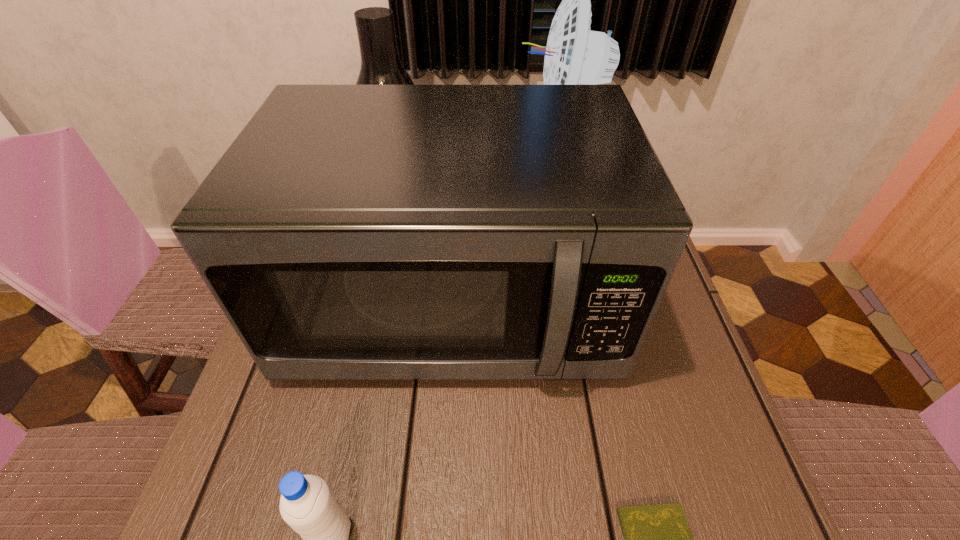
Identify the location of microwave oven that is positioned at the left edge. This screenshot has height=540, width=960. (350, 232).

Find the location of a particular element. The image size is (960, 540). fan that is at the right edge is located at coordinates (574, 55).

Locate an element on the screen. microwave oven present at the right edge is located at coordinates (350, 232).

At what (x,y) coordinates should I click in order to perform the action: click on object at the far right corner. Please return your answer as a coordinate pair (x, y). Looking at the image, I should click on (574, 55).

Image resolution: width=960 pixels, height=540 pixels. Find the location of `free space at the left edge of the desktop`. free space at the left edge of the desktop is located at coordinates (247, 431).

Locate an element on the screen. This screenshot has height=540, width=960. free location at the right edge of the desktop is located at coordinates (655, 377).

Identify which object is located as the second nearest to the shortest object. Please provide its 2D coordinates. Your answer should be formatted as a tuple, i.e. [(x, y)], where the tuple contains the x and y coordinates of a point satisfying the conditions above.

[(307, 504)]

Locate an element on the screen. Image resolution: width=960 pixels, height=540 pixels. object that is the third closest to the oil lamp is located at coordinates (307, 504).

Find the location of a particular element. vacant space that satisfies the following two spatial constraints: 1. on the grille of the fan; 2. on the front-facing side of the microwave oven is located at coordinates [x=603, y=303].